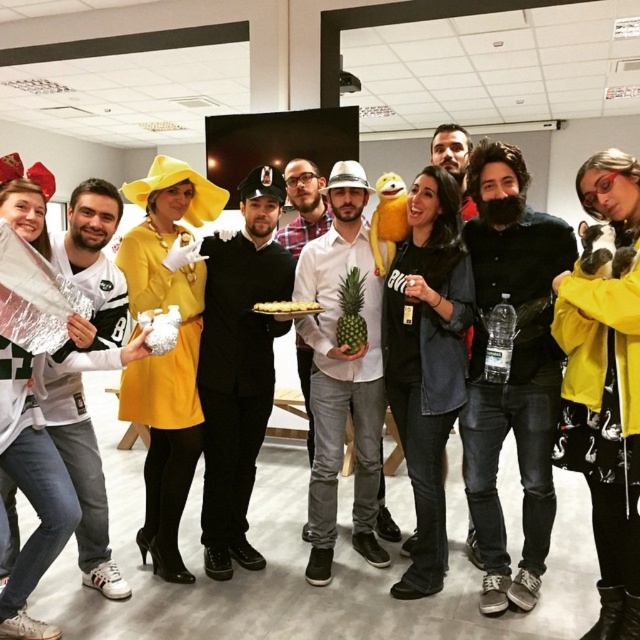
You are a photographer standing at the camera position. You want to take a closeup photo of the white matte pineapple at center. Do you need to move closer or farther away from the pineapple to get a better closeup shot?

Since the white matte pineapple at center is 8.14 feet away from the camera, you would need to move closer to the pineapple to get a better closeup shot.

You are standing in the middle of the room and want to move towards the two points marked in the scene. Which point, point [547,304] or point [93,257], is closer to you?

Point [547,304] is closer to you because it is further to the viewer than point [93,257].

You are standing at the entrance of the room and want to locate the black matte beard at center. Based on the room layout, where should you look relative to the entrance?

The black matte beard at center is located at point 0.580 on the x axis and 0.800 on the y axis, so you should look towards the center of the room slightly to the right and near the back wall.